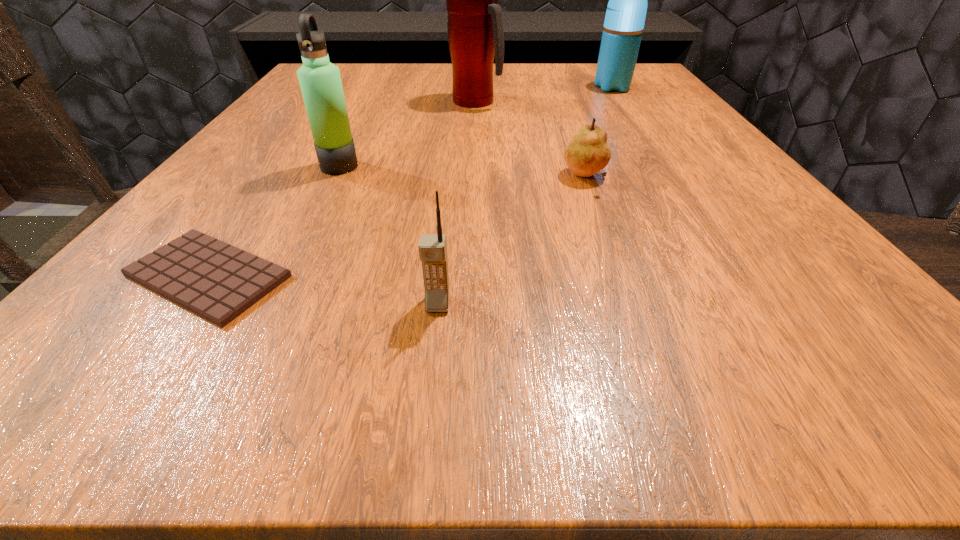
This screenshot has width=960, height=540. Identify the location of the rightmost object. (625, 16).

The width and height of the screenshot is (960, 540). What are the coordinates of `the second thermos bottle from left to right` in the screenshot? It's located at (475, 26).

Where is `the leftmost thermos bottle`? the leftmost thermos bottle is located at coordinates (320, 81).

Where is `cellular telephone`? The image size is (960, 540). cellular telephone is located at coordinates (432, 247).

This screenshot has width=960, height=540. I want to click on pear, so click(x=588, y=153).

Locate an element on the screen. the fifth object from left to right is located at coordinates (588, 153).

Where is `the shortest object`? This screenshot has height=540, width=960. the shortest object is located at coordinates (217, 281).

Find the location of `blank space located 0.330m on the left of the rightmost thermos bottle`. blank space located 0.330m on the left of the rightmost thermos bottle is located at coordinates (451, 87).

Image resolution: width=960 pixels, height=540 pixels. In order to click on free space located 0.280m on the side with the handle of the second thermos bottle from left to right in this screenshot , I will do `click(632, 102)`.

Find the location of a particular element. vacant region located on the right of the nearest thermos bottle is located at coordinates (455, 166).